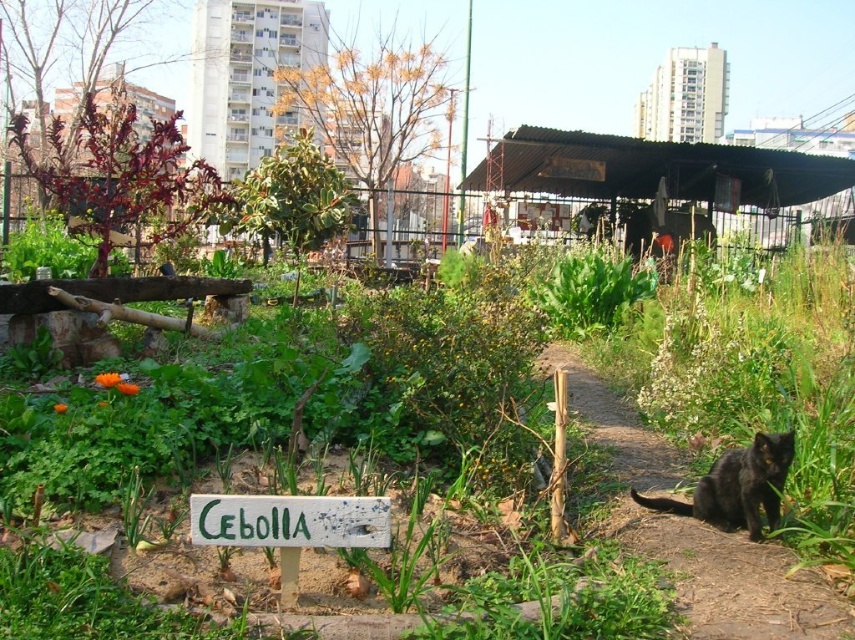
How much distance is there between dirt path at center and black fur cat at lower right?

A distance of 8.12 inches exists between dirt path at center and black fur cat at lower right.

Is point (765, 632) closer to camera compared to point (771, 461)?

Yes, point (765, 632) is closer to viewer.

Does point (728, 625) lie behind point (756, 490)?

That is False.

Locate an element on the screen. dirt path at center is located at coordinates (734, 579).

Is green painted wood sign at center bigger than black fur cat at lower right?

No, green painted wood sign at center is not bigger than black fur cat at lower right.

Is green painted wood sign at center positioned before black fur cat at lower right?

Yes, it is in front of black fur cat at lower right.

Who is more distant from viewer, (x=304, y=506) or (x=699, y=484)?

Point (x=699, y=484)

The image size is (855, 640). Identify the location of green painted wood sign at center. (289, 520).

Is dirt path at center taller than green painted wood sign at center?

Yes, dirt path at center is taller than green painted wood sign at center.

Which is in front, point (821, 636) or point (329, 515)?

Point (329, 515)

The image size is (855, 640). Identify the location of dirt path at center. (734, 579).